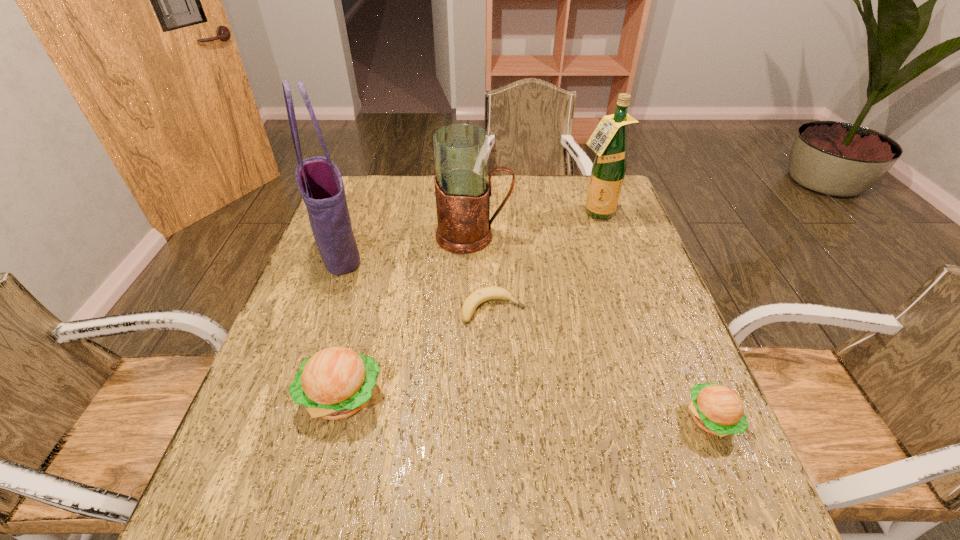
Please point a location where one more hamburger can be added evenly. Please provide its 2D coordinates. Your answer should be formatted as a tuple, i.e. [(x, y)], where the tuple contains the x and y coordinates of a point satisfying the conditions above.

[(522, 408)]